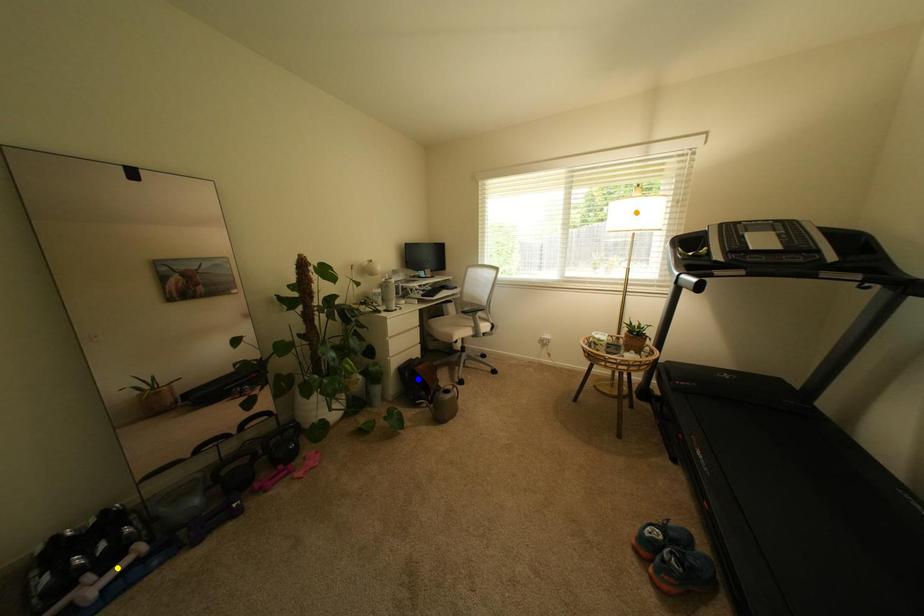
Order these from nearest to farthest:
yellow point
orange point
blue point

yellow point, blue point, orange point